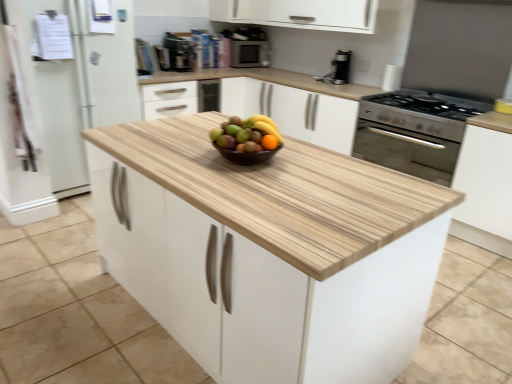
Question: Considering the positions of metallic silver microwave at upper center and white wood cabinet at upper center, which ranks as the 3th cabinetry in bottom-to-top order, in the image, is metallic silver microwave at upper center taller or shorter than white wood cabinet at upper center, which ranks as the 3th cabinetry in bottom-to-top order,?

Choices:
 (A) short
 (B) tall

Answer: (B)

Question: Relative to white wood cabinet at upper center, the 3th cabinetry in the front-to-back sequence, is metallic silver microwave at upper center in front or behind?

Choices:
 (A) behind
 (B) front

Answer: (A)

Question: Estimate the real-world distances between objects in this image. Which object is farther from the satin black coffee maker at upper right?

Choices:
 (A) white matte cabinet at right, placed as the 2th cabinetry when sorted from front to back
 (B) white wood cabinet at upper center, the 1th cabinetry from the top
 (C) natural wood cabinet at center, marked as the third cabinetry in a top-to-bottom arrangement
 (D) orange matte grapefruit at center
 (E) metallic silver microwave at upper center

Answer: (C)

Question: Which object is positioned closest to the white wood cabinet at upper center, positioned as the first cabinetry in back-to-front order?

Choices:
 (A) satin black coffee maker at upper right
 (B) natural wood cabinet at center, marked as the third cabinetry in a top-to-bottom arrangement
 (C) black plastic coffee machine at upper center
 (D) orange matte grapefruit at center
 (E) white matte cabinet at right, placed as the 2th cabinetry when sorted from front to back

Answer: (C)